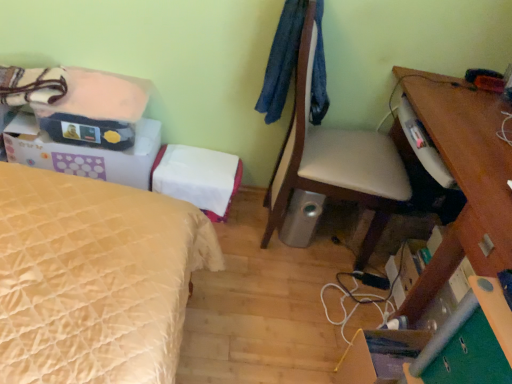
You are a GUI agent. You are given a task and a screenshot of the screen. Output one action in this format:
    pyautogui.click(x=<x>, y=<y>)
    Task: Click on the vacant point to the right of silver metallic speaker at lower center
    The height and width of the screenshot is (384, 512).
    Given the screenshot: What is the action you would take?
    tap(333, 244)